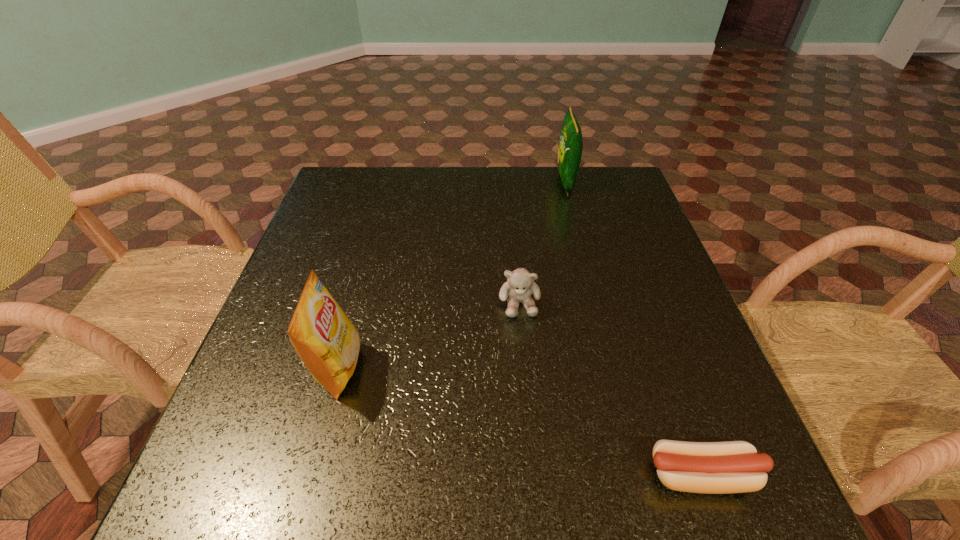
What are the coordinates of `vacant space located 0.280m on the front-facing side of the right crisp (potato chip)` in the screenshot? It's located at (463, 182).

What are the coordinates of `free space located on the front-facing side of the nearer crisp (potato chip)` in the screenshot? It's located at (531, 368).

Locate an element on the screen. The width and height of the screenshot is (960, 540). free space located on the face of the second object from left to right is located at coordinates (523, 345).

Locate an element on the screen. vacant space located 0.250m on the left of the shortest object is located at coordinates (491, 475).

Where is `object positioned at the far edge`? This screenshot has width=960, height=540. object positioned at the far edge is located at coordinates (570, 147).

Find the location of a particular element. The height and width of the screenshot is (540, 960). object located at the near edge is located at coordinates (727, 467).

The height and width of the screenshot is (540, 960). Identify the location of object that is at the left edge. (325, 339).

Identify the location of object situated at the right edge. This screenshot has height=540, width=960. (727, 467).

Image resolution: width=960 pixels, height=540 pixels. Find the location of `object at the near right corner`. object at the near right corner is located at coordinates pos(727,467).

Find the location of `vacant area at the far edge of the desktop`. vacant area at the far edge of the desktop is located at coordinates (416, 205).